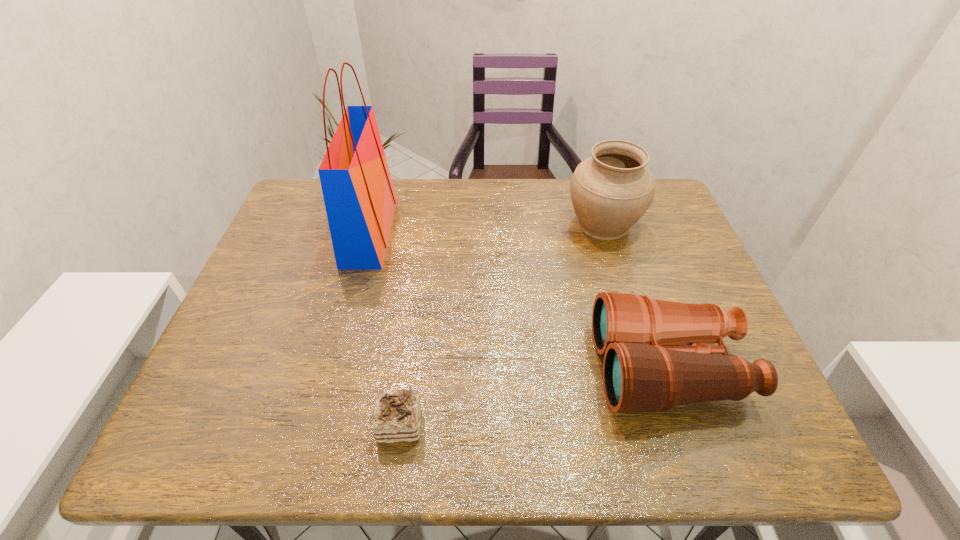
Locate an element on the screen. The image size is (960, 540). vacant area in the image that satisfies the following two spatial constraints: 1. through the lenses of the binoculars; 2. on the front side of the second object from left to right is located at coordinates 687,424.